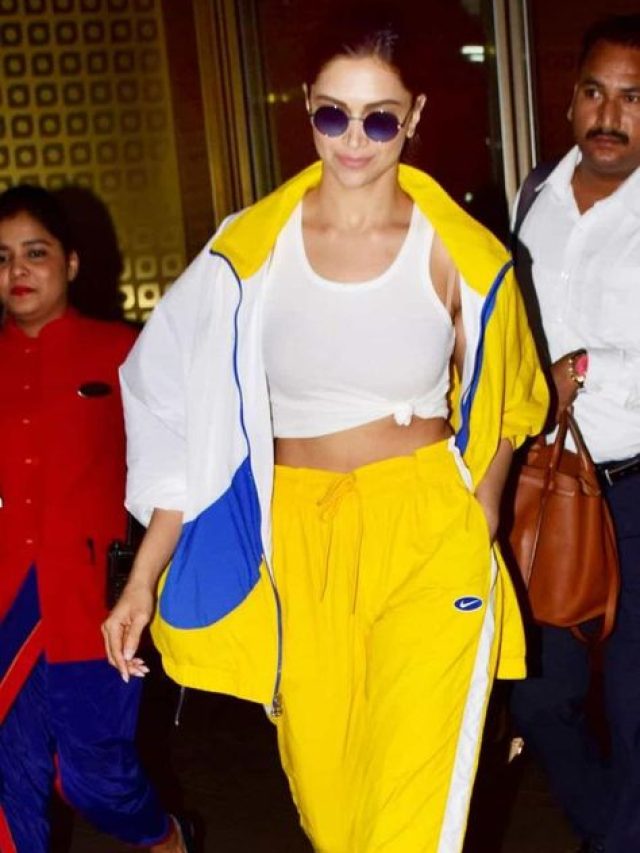
You are a GUI agent. You are given a task and a screenshot of the screen. Output one action in this format:
    pyautogui.click(x=<x>, y=<y>)
    Task: Click on the window
    
    Given the screenshot: What is the action you would take?
    pyautogui.click(x=97, y=128)